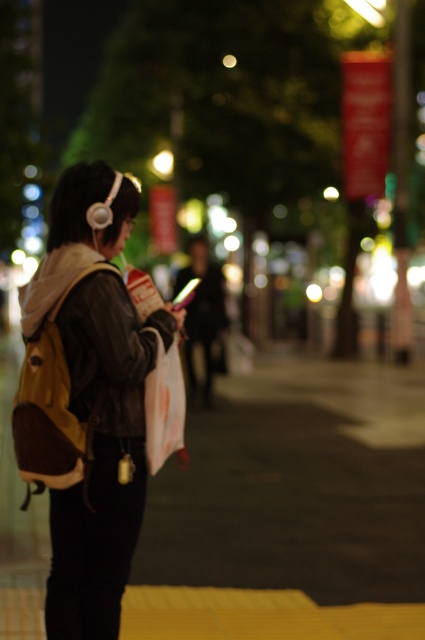
Question: Is yellow asphalt at center to the right of leather jacket at left from the viewer's perspective?

Choices:
 (A) no
 (B) yes

Answer: (B)

Question: Does yellow asphalt at center have a lesser width compared to leather jacket at left?

Choices:
 (A) no
 (B) yes

Answer: (A)

Question: Does yellow asphalt at center appear over leather jacket at left?

Choices:
 (A) yes
 (B) no

Answer: (B)

Question: Which point is closer to the camera?

Choices:
 (A) yellow asphalt at center
 (B) leather jacket at left

Answer: (B)